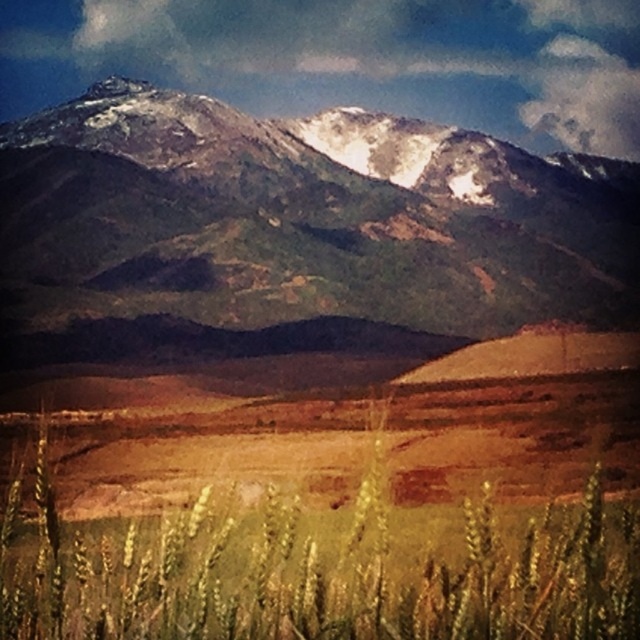
Which is in front, point (291, 202) or point (102, 564)?

Point (102, 564) is in front.

Can you confirm if snowy rocky mountain range at upper center is positioned to the left of golden matte wheat field at lower center?

Correct, you'll find snowy rocky mountain range at upper center to the left of golden matte wheat field at lower center.

Describe the element at coordinates (301, 221) in the screenshot. This screenshot has height=640, width=640. I see `snowy rocky mountain range at upper center` at that location.

This screenshot has width=640, height=640. I want to click on snowy rocky mountain range at upper center, so click(301, 221).